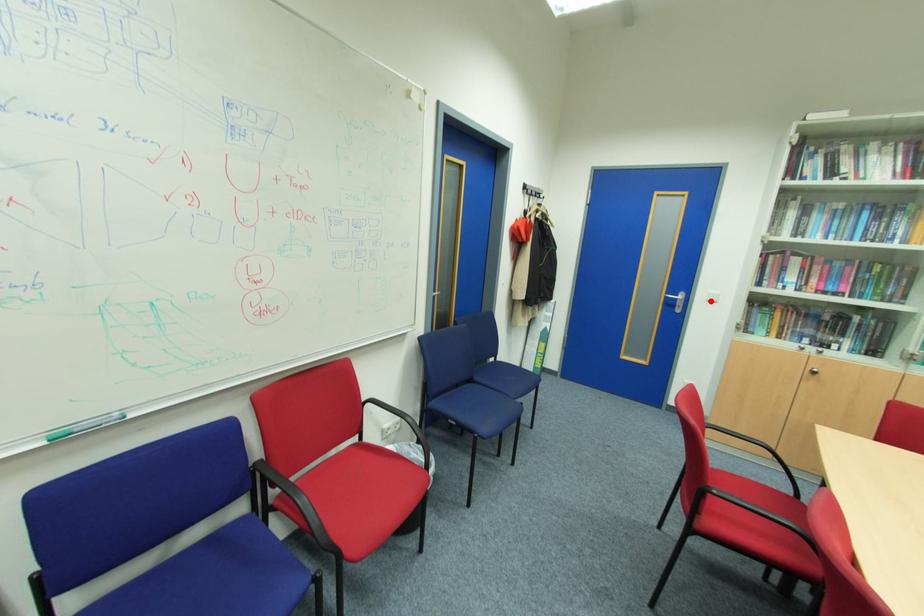
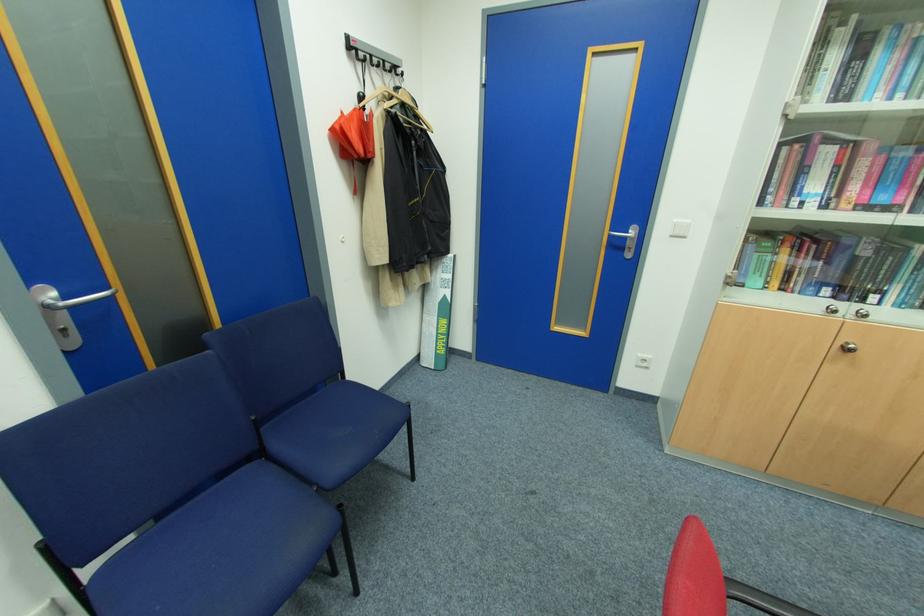
Find the pixel in the second image that matches the highlighted location in the first image.

(675, 236)